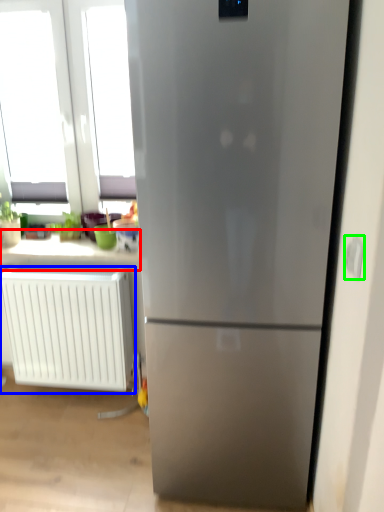
Question: Which is nearer to the counter top (highlighted by a red box)? radiator (highlighted by a blue box) or electric outlet (highlighted by a green box).

Choices:
 (A) radiator
 (B) electric outlet

Answer: (A)